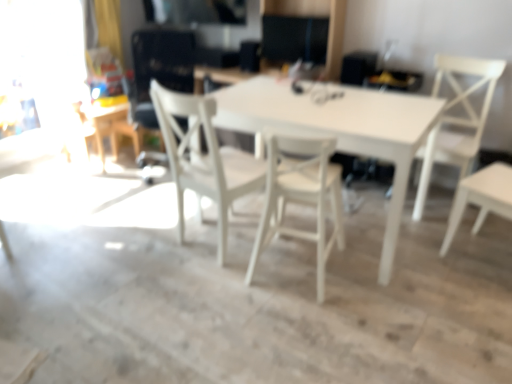
Question: Which direction should I rotate to look at white matte table at center, marked as the second table in a left-to-right arrangement, — up or down?

Choices:
 (A) up
 (B) down

Answer: (A)

Question: From the image's perspective, is white matte chair at right, acting as the first chair starting from the right, located beneath white matte table at center, marked as the second table in a left-to-right arrangement?

Choices:
 (A) yes
 (B) no

Answer: (B)

Question: Does white matte chair at right, acting as the first chair starting from the right, touch white matte table at center, which is the 1th table from front to back?

Choices:
 (A) no
 (B) yes

Answer: (A)

Question: Can you confirm if white matte chair at right, arranged as the third chair when viewed from the left, is thinner than white matte table at center, the 2th table from the back?

Choices:
 (A) no
 (B) yes

Answer: (B)

Question: Is white matte chair at right, acting as the first chair starting from the right, far away from white matte table at center, positioned as the first table in right-to-left order?

Choices:
 (A) no
 (B) yes

Answer: (A)

Question: Is white matte chair at right, acting as the first chair starting from the right, further to the viewer compared to white matte table at center, positioned as the first table in right-to-left order?

Choices:
 (A) yes
 (B) no

Answer: (A)

Question: Does white matte chair at right, arranged as the third chair when viewed from the left, have a larger size compared to white matte table at center, positioned as the first table in right-to-left order?

Choices:
 (A) yes
 (B) no

Answer: (B)

Question: Considering the relative sizes of white wood chair at center, placed as the 3th chair when sorted from right to left, and white wood chair at center, the 2th chair from the left, in the image provided, is white wood chair at center, placed as the 3th chair when sorted from right to left, bigger than white wood chair at center, the 2th chair from the left,?

Choices:
 (A) no
 (B) yes

Answer: (B)

Question: Is white wood chair at center, placed as the 3th chair when sorted from right to left, positioned beyond the bounds of white wood chair at center, positioned as the second chair in right-to-left order?

Choices:
 (A) no
 (B) yes

Answer: (B)

Question: Can white wood chair at center, the 2th chair from the left, be found inside white wood chair at center, which ranks as the 1th chair in left-to-right order?

Choices:
 (A) no
 (B) yes

Answer: (A)

Question: Considering the relative sizes of white wood chair at center, placed as the 3th chair when sorted from right to left, and white wood chair at center, positioned as the second chair in right-to-left order, in the image provided, is white wood chair at center, placed as the 3th chair when sorted from right to left, taller than white wood chair at center, positioned as the second chair in right-to-left order,?

Choices:
 (A) yes
 (B) no

Answer: (A)

Question: Is white wood chair at center, positioned as the second chair in right-to-left order, at the back of white wood chair at center, which ranks as the 1th chair in left-to-right order?

Choices:
 (A) no
 (B) yes

Answer: (A)

Question: From a real-world perspective, is white wood chair at center, which ranks as the 1th chair in left-to-right order, positioned over white wood chair at center, the 2th chair from the left, based on gravity?

Choices:
 (A) yes
 (B) no

Answer: (A)

Question: Can we say white matte table at upper left, which appears as the 2th table when viewed from the right, lies outside white wood chair at center, placed as the 3th chair when sorted from right to left?

Choices:
 (A) yes
 (B) no

Answer: (A)